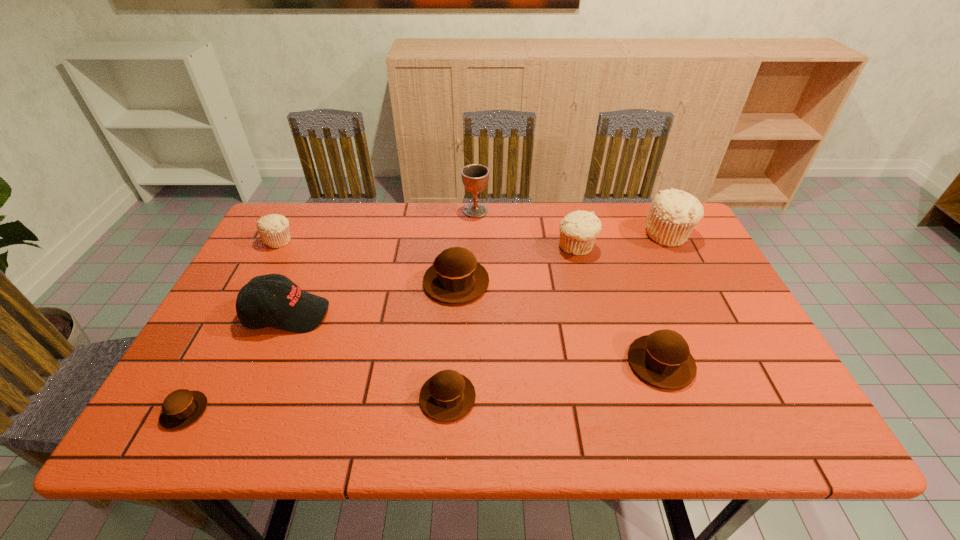
The height and width of the screenshot is (540, 960). I want to click on free area in between the second beige muffin from right to left and the leftmost beige muffin, so click(x=428, y=244).

Identify the location of vacant space in between the rightmost brown muffin and the second smallest beige muffin. Image resolution: width=960 pixels, height=540 pixels. (618, 305).

Identify which object is the second closest to the smallest beige muffin. Please provide its 2D coordinates. Your answer should be formatted as a tuple, i.e. [(x, y)], where the tuple contains the x and y coordinates of a point satisfying the conditions above.

[(455, 277)]

Select which object is the second closest to the rightmost object. Please provide its 2D coordinates. Your answer should be formatted as a tuple, i.e. [(x, y)], where the tuple contains the x and y coordinates of a point satisfying the conditions above.

[(663, 359)]

Identify which muffin is located as the third nearest to the black baseball cap. Please provide its 2D coordinates. Your answer should be formatted as a tuple, i.e. [(x, y)], where the tuple contains the x and y coordinates of a point satisfying the conditions above.

[(455, 277)]

Where is `the third closest muffin to the second beige muffin from left to right`? the third closest muffin to the second beige muffin from left to right is located at coordinates (663, 359).

Identify which beige muffin is the second closest to the biggest brown muffin. Please provide its 2D coordinates. Your answer should be formatted as a tuple, i.e. [(x, y)], where the tuple contains the x and y coordinates of a point satisfying the conditions above.

[(274, 229)]

The image size is (960, 540). Find the location of `beige muffin that is the closest one to the shortest object`. beige muffin that is the closest one to the shortest object is located at coordinates (274, 229).

Point out which brown muffin is positioned as the nearest to the rightmost brown muffin. Please provide its 2D coordinates. Your answer should be formatted as a tuple, i.e. [(x, y)], where the tuple contains the x and y coordinates of a point satisfying the conditions above.

[(455, 277)]

The width and height of the screenshot is (960, 540). I want to click on the third closest brown muffin to the chalice, so click(x=447, y=396).